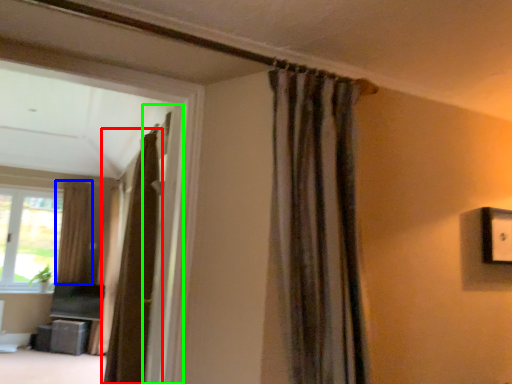
Question: Considering the real-world distances, which object is farthest from curtain (highlighted by a red box)? curtain (highlighted by a blue box) or screen door (highlighted by a green box)?

Choices:
 (A) curtain
 (B) screen door

Answer: (A)